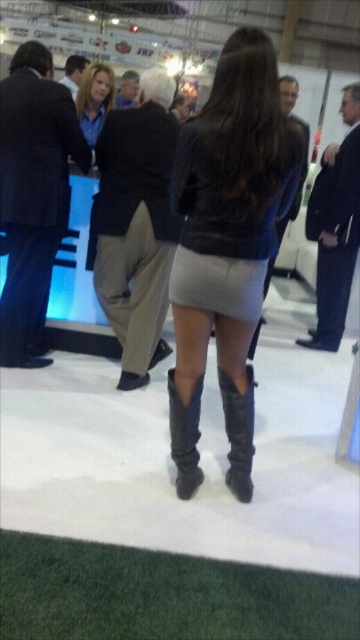
A person wants to walk from the light gray leather skirt at center to the counter with a blue lit display in the background. How far will they have to walk?

The distance between the light gray leather skirt at center and the counter with a blue lit display in the background is 1.70 meters.

You are standing in the exhibition space and want to move from the point closer to you to the point further away. Which path should you take between the two points, point [190,321] and point [231,442]?

You should move from point [190,321] to point [231,442] because point [190,321] is closer to the viewer and you need to go towards the point further away.

You are a photographer standing at the entrance of the exhibition hall. You want to capture a photo of the light gray leather skirt at center. Where should you position yourself to ensure it is in the frame?

The light gray leather skirt at center is located at coordinates point (x=225, y=202). Position yourself so your camera is aimed at that point to capture it in the frame.